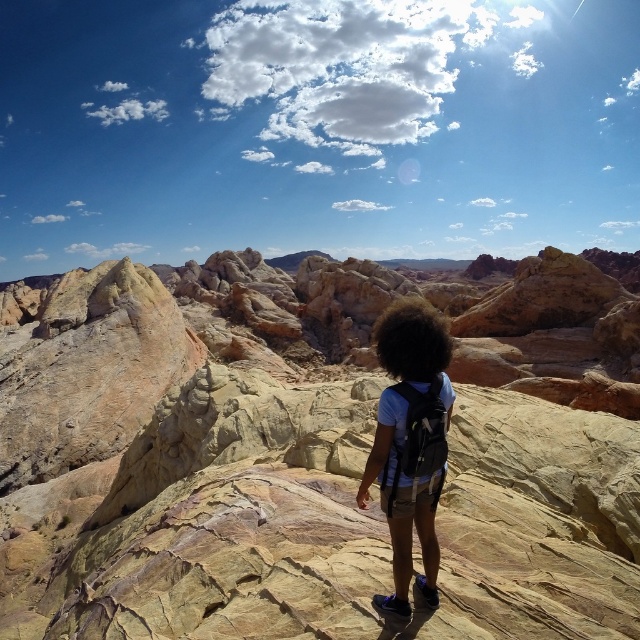
Does smooth sandstone rock at center have a greater width compared to matte black backpack at center?

Yes.

Is smooth sandstone rock at center positioned behind matte black backpack at center?

That is False.

Identify the location of smooth sandstone rock at center. (300, 464).

Between point (92, 465) and point (422, 368), which one is positioned behind?

Positioned behind is point (92, 465).

Is smooth sandstone rock at center closer to camera compared to dark curly hair at center?

Yes, smooth sandstone rock at center is closer to the viewer.

At what (x,y) coordinates should I click in order to perform the action: click on smooth sandstone rock at center. Please return your answer as a coordinate pair (x, y). The width and height of the screenshot is (640, 640). Looking at the image, I should click on (300, 464).

Between matte black backpack at center and dark curly hair at center, which one is positioned higher?

dark curly hair at center is above.

Measure the distance between matte black backpack at center and camera.

143.15 feet

Identify the location of matte black backpack at center. (403, 504).